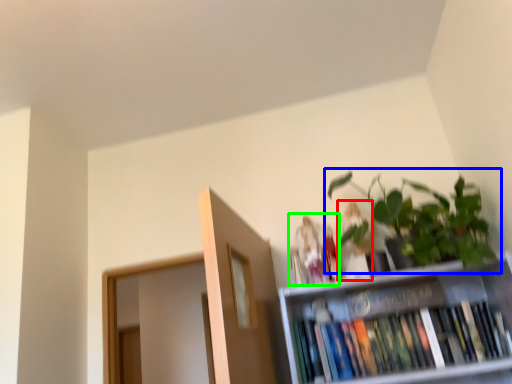
Question: Based on their relative distances, which object is farther from toy (highlighted by a red box)? Choose from houseplant (highlighted by a blue box) and toy (highlighted by a green box).

Choices:
 (A) houseplant
 (B) toy

Answer: (A)